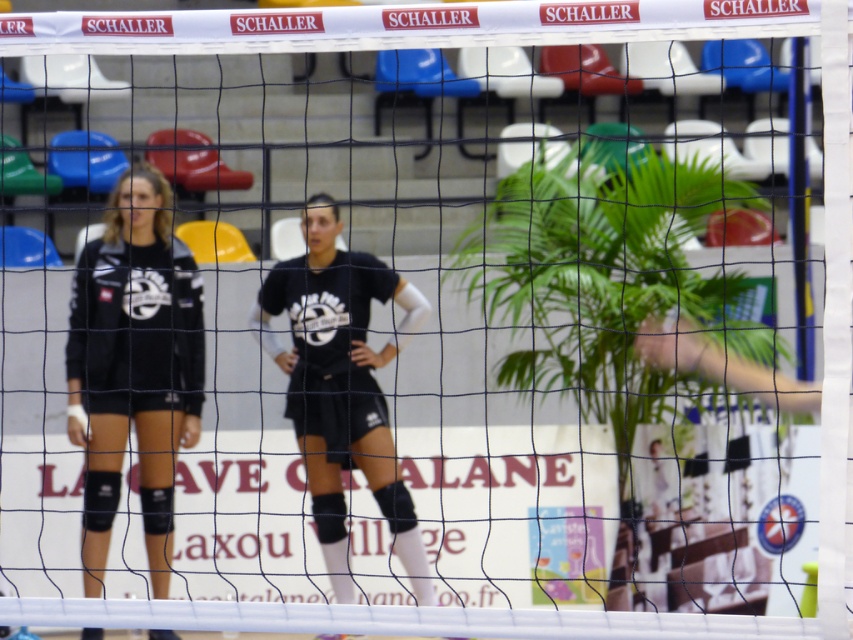
You are a photographer taking a picture of the volleyball players. You notice two players wearing black matte uniform at center and matte black uniform at center. Which player is standing more to the left?

The black matte uniform at center is positioned on the left side of matte black uniform at center, so the player wearing the black matte uniform at center is standing more to the left.

You are a photographer positioned behind the volleyball net. You want to capture both the black matte uniform at center and the matte black uniform at center in a single shot. Which one of the two uniforms will appear closer to the camera in the photo?

The black matte uniform at center appears closer to the camera because it is in front of the matte black uniform at center.